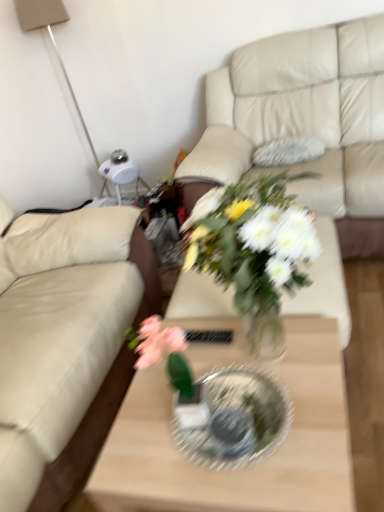
Identify the location of vacant area on top of clear glass coffee table at center (from a real-world perspective). (240, 391).